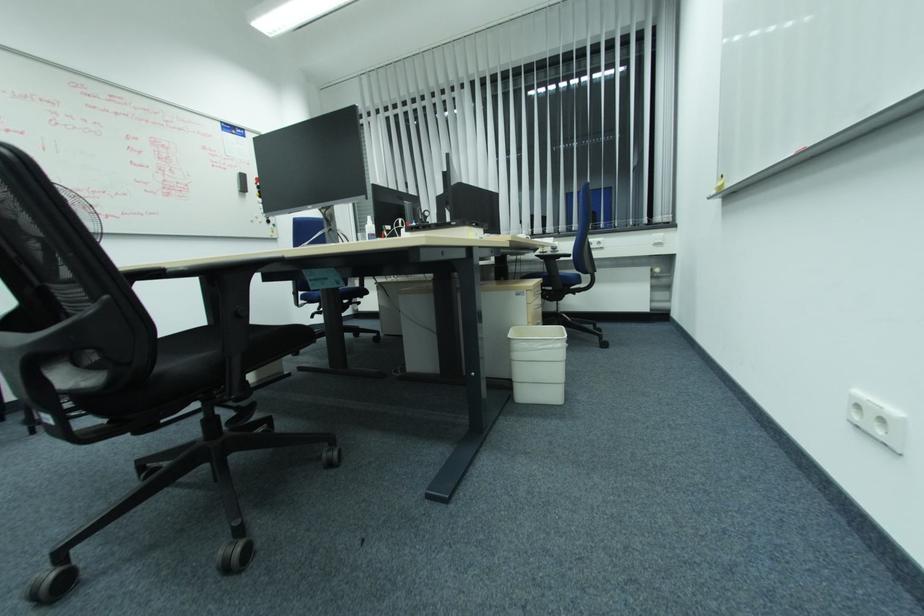
Where would you press the sanitizer bottle pump? Please return your answer as a coordinate pair (x, y).

(370, 228)